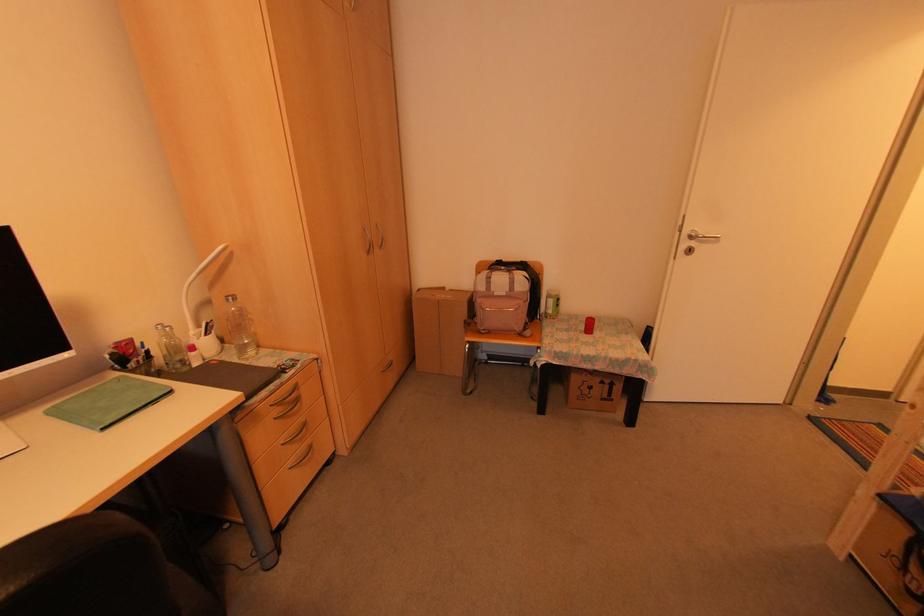
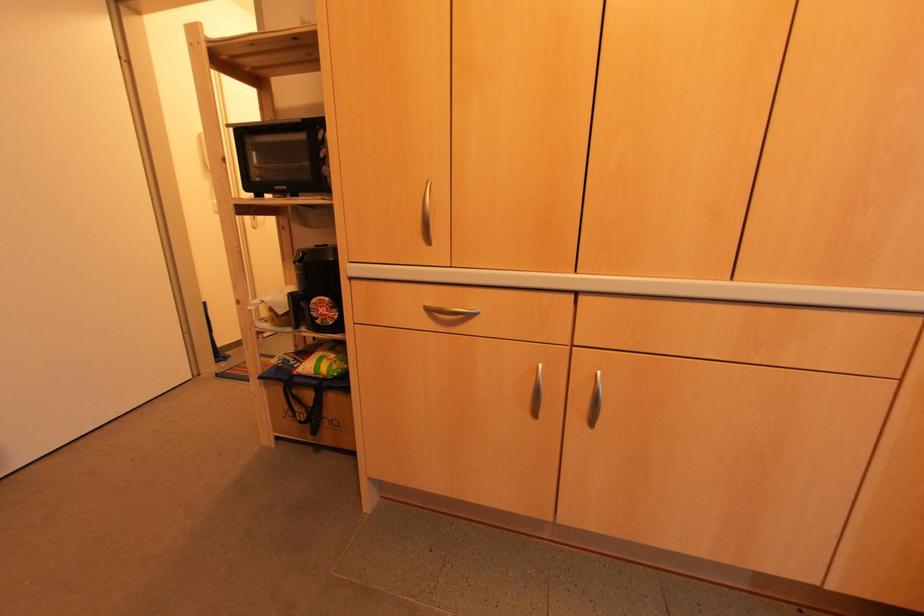
Question: How did the camera likely rotate?

Choices:
 (A) Left
 (B) Right
 (C) Up
 (D) Down

Answer: (B)